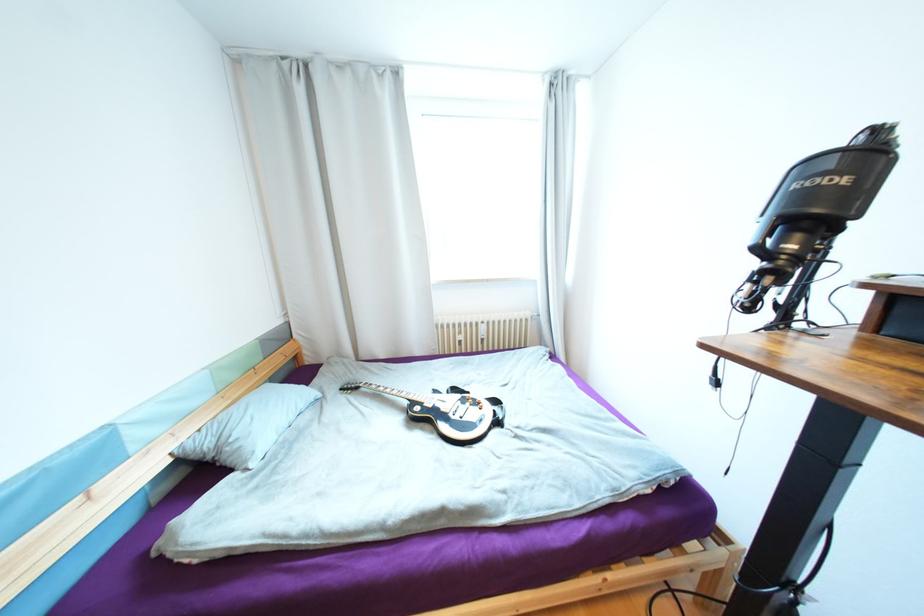
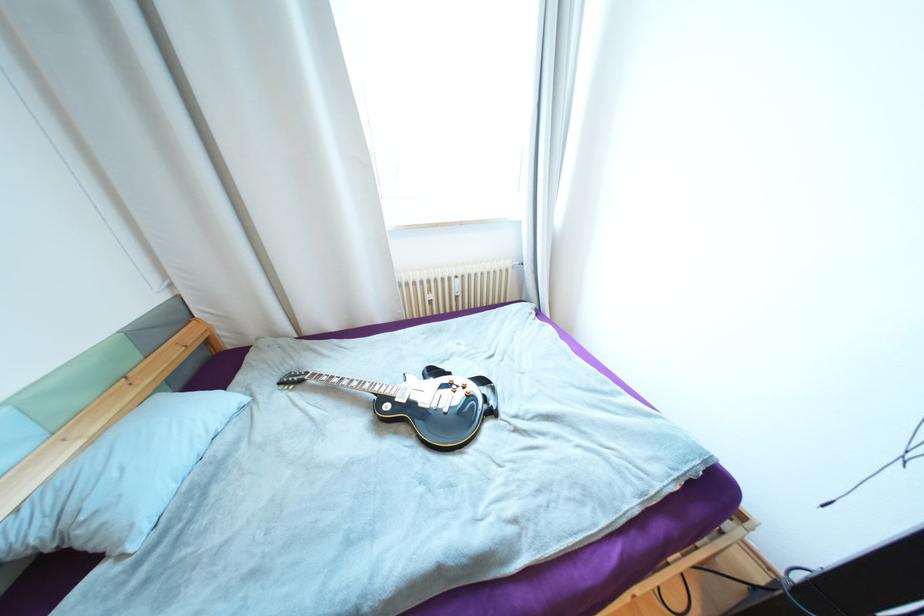
In the second image, find the point that corresponds to the point at 504,424 in the first image.

(497, 413)